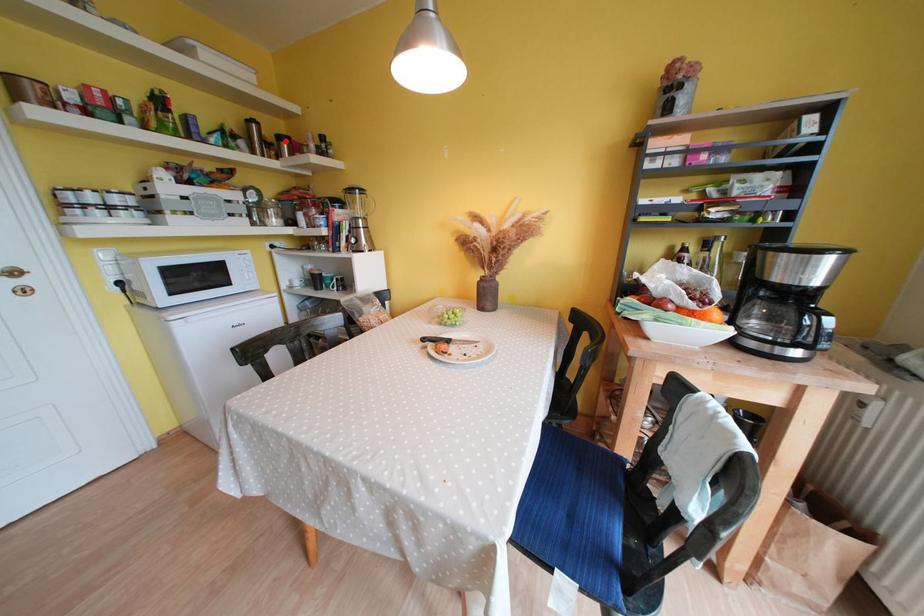
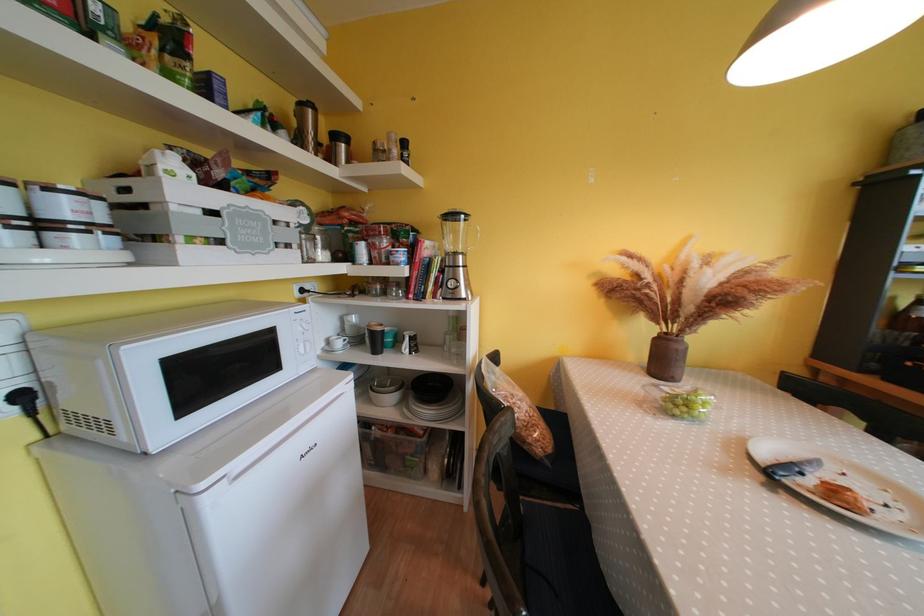
Where in the second image is the point corresponding to the highlighted location from the first image?

(342, 140)